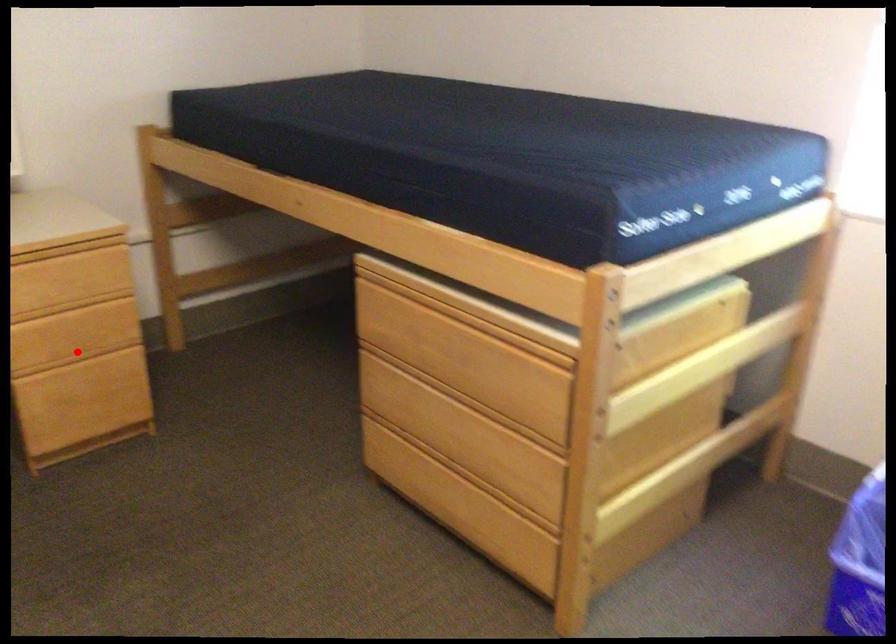
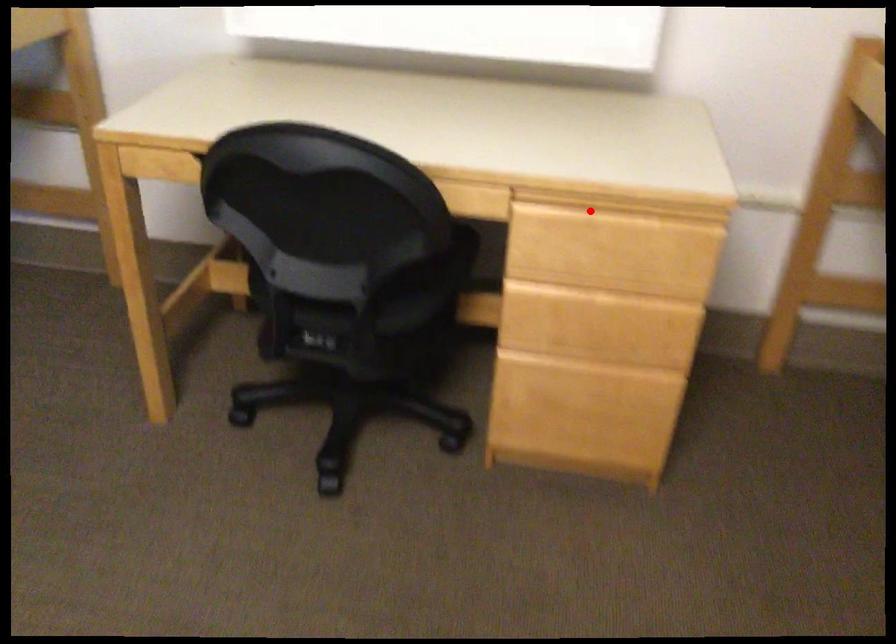
I am providing you with two images of the same scene from different viewpoints. A red point is marked on the first image and another point is marked on the second image. Is the marked point in image1 the same physical position as the marked point in image2?

No